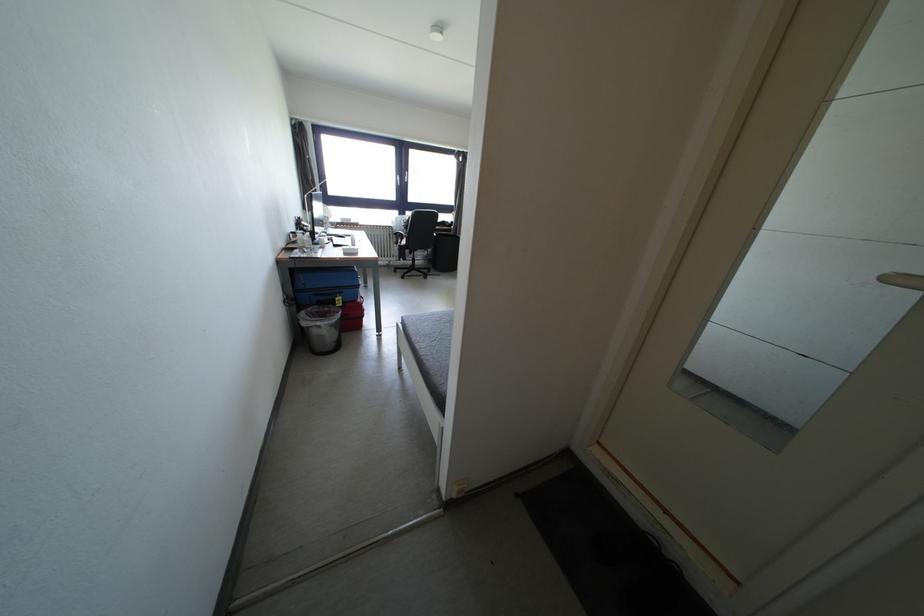
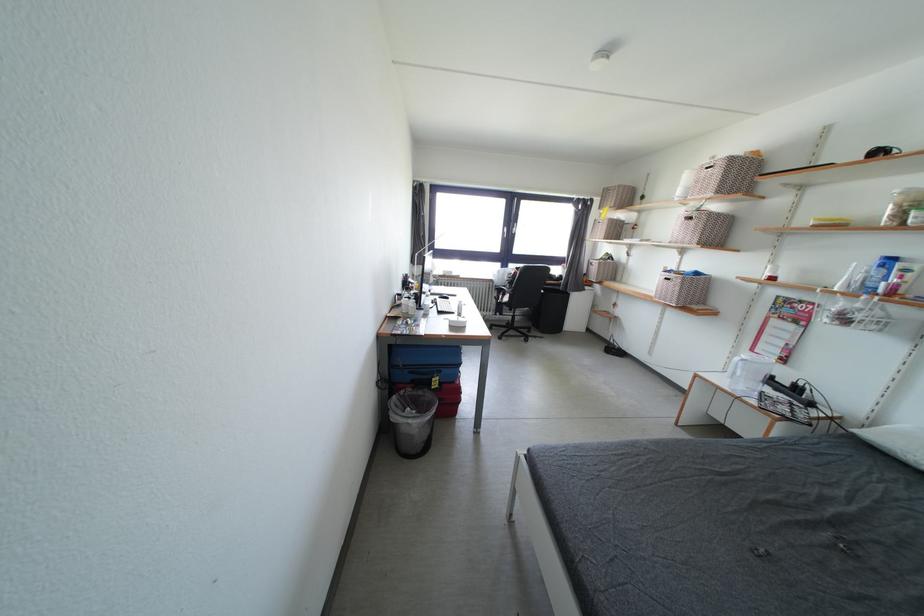
In the second image, find the point that corresponds to (x=410, y=219) in the first image.

(514, 270)